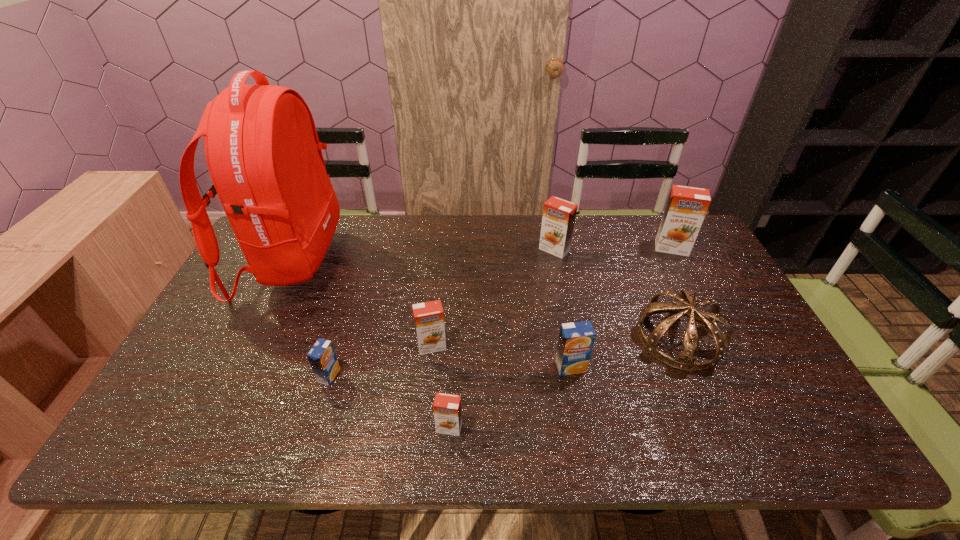
Image resolution: width=960 pixels, height=540 pixels. I want to click on the smaller blue orange_juice, so click(x=322, y=357).

In order to click on the leftmost orange juice in this screenshot , I will do `click(322, 357)`.

Identify the location of the nearest orange juice. This screenshot has height=540, width=960. (447, 409).

Locate an element on the screen. This screenshot has width=960, height=540. the nearest orange orange juice is located at coordinates (447, 409).

Where is `free space located 0.070m on the main compartment of the backpack`? The width and height of the screenshot is (960, 540). free space located 0.070m on the main compartment of the backpack is located at coordinates (360, 261).

Where is `free spot located on the right of the rightmost orange orange juice`? The width and height of the screenshot is (960, 540). free spot located on the right of the rightmost orange orange juice is located at coordinates 708,248.

Where is `free location located 0.070m on the front of the third tallest object`? The height and width of the screenshot is (540, 960). free location located 0.070m on the front of the third tallest object is located at coordinates (560, 273).

This screenshot has height=540, width=960. What are the coordinates of `free space located 0.270m on the back of the brown tiara` in the screenshot? It's located at (641, 250).

At what (x,y) coordinates should I click in order to perform the action: click on free space located on the front of the second nearest orange orange juice. Please return your answer as a coordinate pair (x, y). Looking at the image, I should click on (428, 381).

This screenshot has width=960, height=540. I want to click on vacant space situated on the left of the bigger blue orange_juice, so click(x=520, y=367).